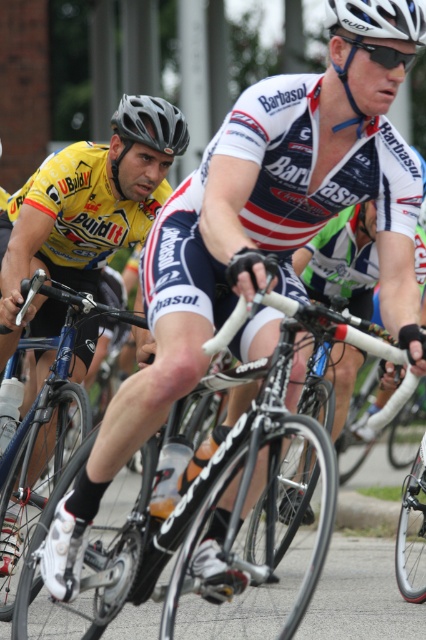
Who is more distant from viewer, (31,632) or (334,20)?

Positioned behind is point (31,632).

Between shiny black frame at center and white matte bicycle helmet at upper center, which one is positioned lower?

shiny black frame at center is lower down.

The width and height of the screenshot is (426, 640). What do you see at coordinates (201, 518) in the screenshot?
I see `shiny black frame at center` at bounding box center [201, 518].

The width and height of the screenshot is (426, 640). In order to click on shiny black frame at center in this screenshot , I will do `click(201, 518)`.

Can you confirm if white matte helmet at upper center is positioned below matte black helmet at upper center?

Correct, white matte helmet at upper center is located below matte black helmet at upper center.

Who is positioned more to the right, white matte helmet at upper center or matte black helmet at upper center?

From the viewer's perspective, white matte helmet at upper center appears more on the right side.

Based on the photo, who is more forward, (330, 28) or (181, 138)?

Point (330, 28) is in front.

What are the coordinates of `white matte helmet at upper center` in the screenshot? It's located at (374, 36).

Does shiny black frame at center have a larger size compared to shiny blue frame at center?

Incorrect, shiny black frame at center is not larger than shiny blue frame at center.

Does point (95, 577) come farther from viewer compared to point (60, 378)?

No, it is in front of (60, 378).

At what (x,y) coordinates should I click in order to perform the action: click on shiny black frame at center. Please return your answer as a coordinate pair (x, y). This screenshot has width=426, height=640. Looking at the image, I should click on (201, 518).